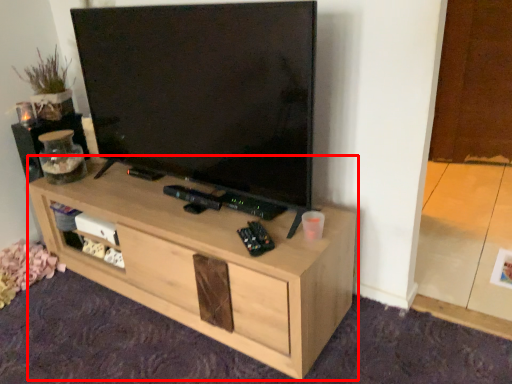
Question: Considering the relative positions of desk (annotated by the red box) and speaker in the image provided, where is desk (annotated by the red box) located with respect to the staircase?

Choices:
 (A) right
 (B) left

Answer: (A)